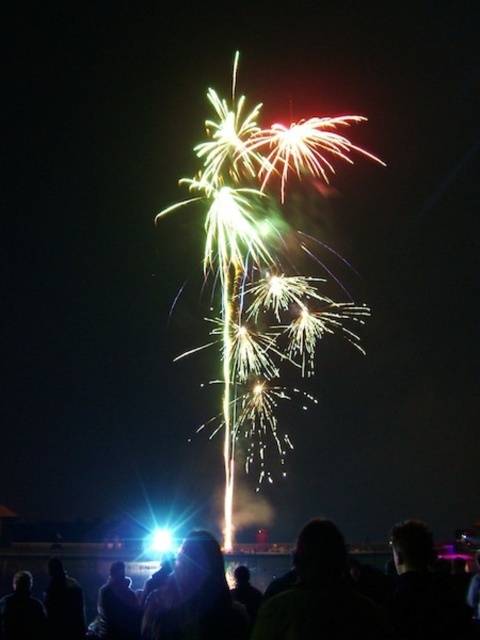
Question: Is black matte crowd at lower center to the right of black matte person at lower center from the viewer's perspective?

Choices:
 (A) yes
 (B) no

Answer: (A)

Question: Which point is closer to the camera taking this photo?

Choices:
 (A) (189, 564)
 (B) (41, 548)

Answer: (A)

Question: Does black matte crowd at lower center appear under black matte person at lower center?

Choices:
 (A) no
 (B) yes

Answer: (B)

Question: Is black matte crowd at lower center bigger than black matte person at lower center?

Choices:
 (A) no
 (B) yes

Answer: (B)

Question: Which point appears closest to the camera in this image?

Choices:
 (A) (165, 600)
 (B) (105, 576)

Answer: (A)

Question: Which of the following is the farthest from the observer?

Choices:
 (A) (213, 612)
 (B) (0, 554)

Answer: (B)